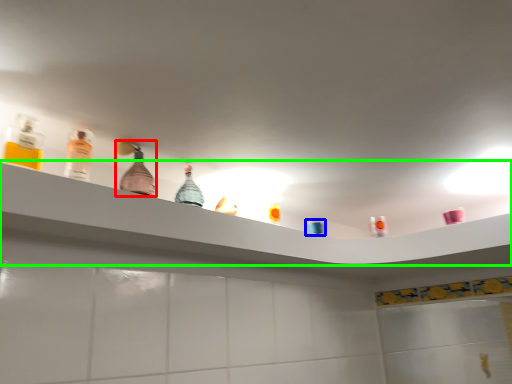
Question: Which is farther away from bottle (highlighted by a red box)? toiletry (highlighted by a blue box) or shelf (highlighted by a green box)?

Choices:
 (A) toiletry
 (B) shelf

Answer: (A)